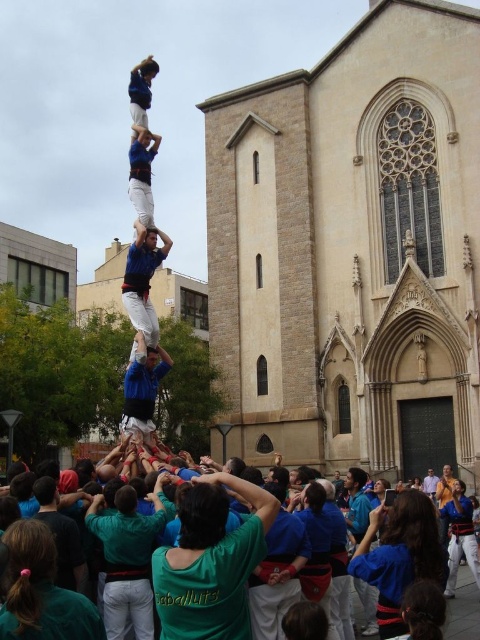
Is beige stone church at center closer to camera compared to light blue shirt at center?

Yes, beige stone church at center is closer to the viewer.

Does point (388, 220) come in front of point (429, 468)?

No, it is behind (429, 468).

Find the location of a particular element. beige stone church at center is located at coordinates (352, 248).

Which of these two, blue fabric man at center or blue fabric shirt at center, stands taller?

With more height is blue fabric man at center.

Is blue fabric man at center to the left of blue fabric shirt at center from the viewer's perspective?

Indeed, blue fabric man at center is positioned on the left side of blue fabric shirt at center.

Which is behind, point (128, 280) or point (137, 436)?

The point (128, 280) is more distant.

In order to click on blue fabric man at center in this screenshot , I will do `click(143, 280)`.

Who is lower down, beige stone church at center or blue fabric man at center?

blue fabric man at center

Is beige stone church at center below blue fabric man at center?

Actually, beige stone church at center is above blue fabric man at center.

I want to click on beige stone church at center, so click(x=352, y=248).

Locate an element on the screen. beige stone church at center is located at coordinates (352, 248).